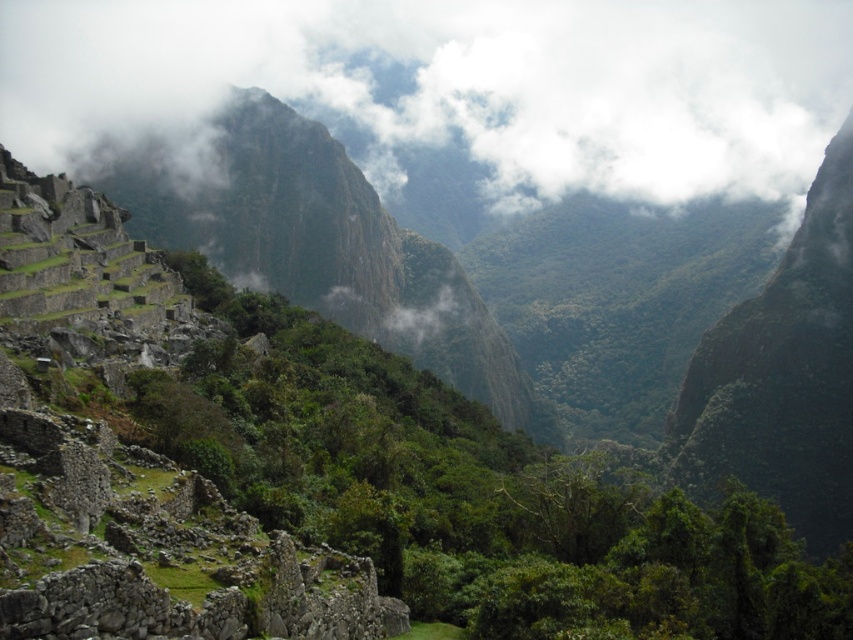
Does white fluffy cloud at upper center have a lesser height compared to green leafy vegetation at center?

No, white fluffy cloud at upper center is not shorter than green leafy vegetation at center.

Who is higher up, white fluffy cloud at upper center or green leafy vegetation at center?

Positioned higher is white fluffy cloud at upper center.

At what (x,y) coordinates should I click in order to perform the action: click on white fluffy cloud at upper center. Please return your answer as a coordinate pair (x, y). This screenshot has height=640, width=853. Looking at the image, I should click on (460, 83).

Where is `white fluffy cloud at upper center`? The height and width of the screenshot is (640, 853). white fluffy cloud at upper center is located at coordinates (460, 83).